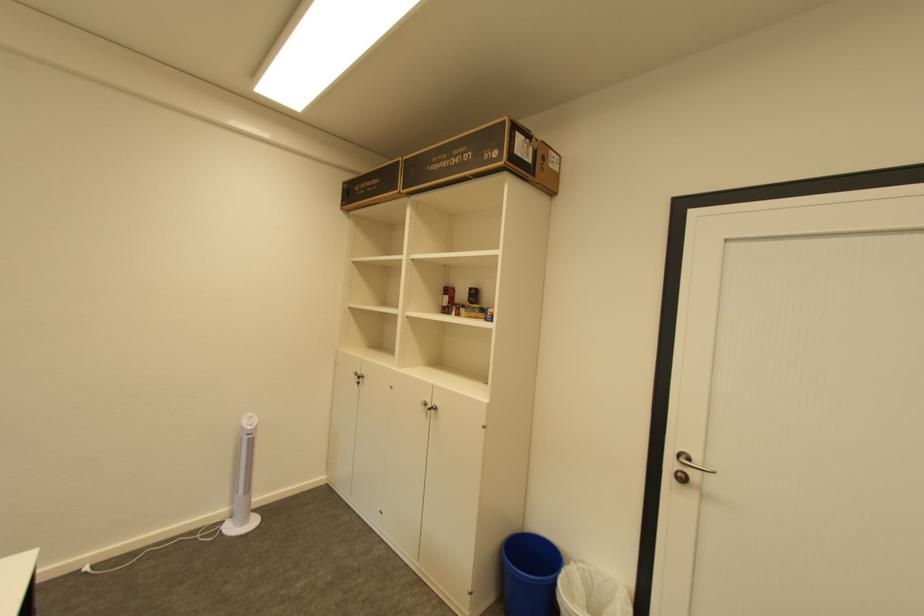
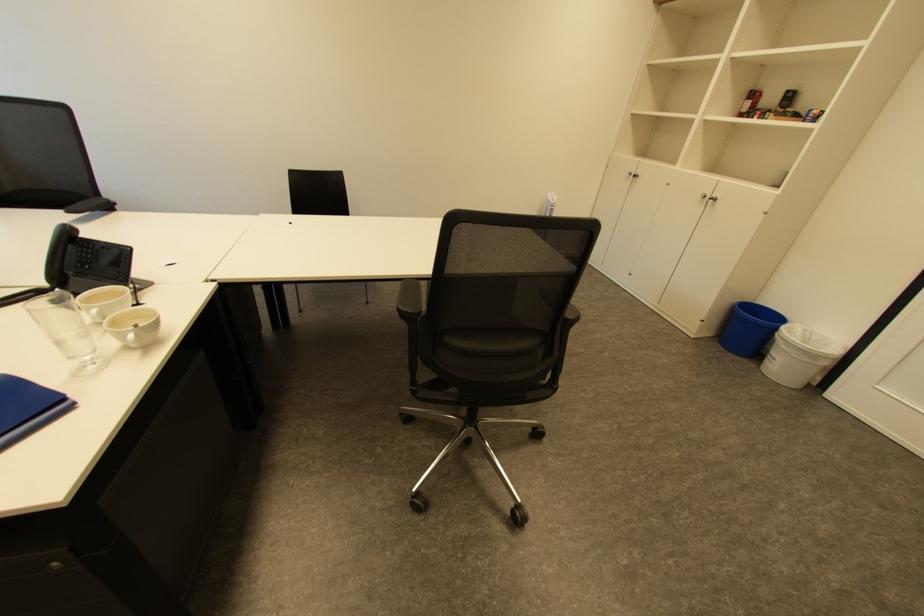
Locate, in the second image, the point that corresponds to point (432, 405) in the first image.

(711, 196)